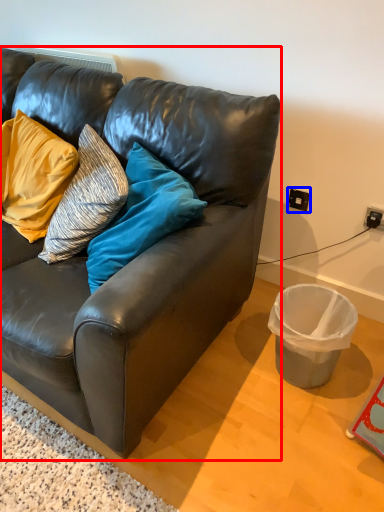
Question: Among these objects, which one is nearest to the camera, studio couch (highlighted by a red box) or power outlet (highlighted by a blue box)?

Choices:
 (A) studio couch
 (B) power outlet

Answer: (A)